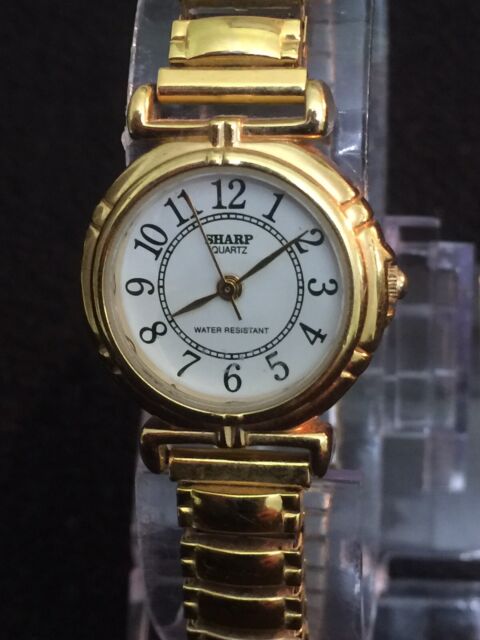
Where is `clear plastic holder`? Image resolution: width=480 pixels, height=640 pixels. clear plastic holder is located at coordinates (434, 355).